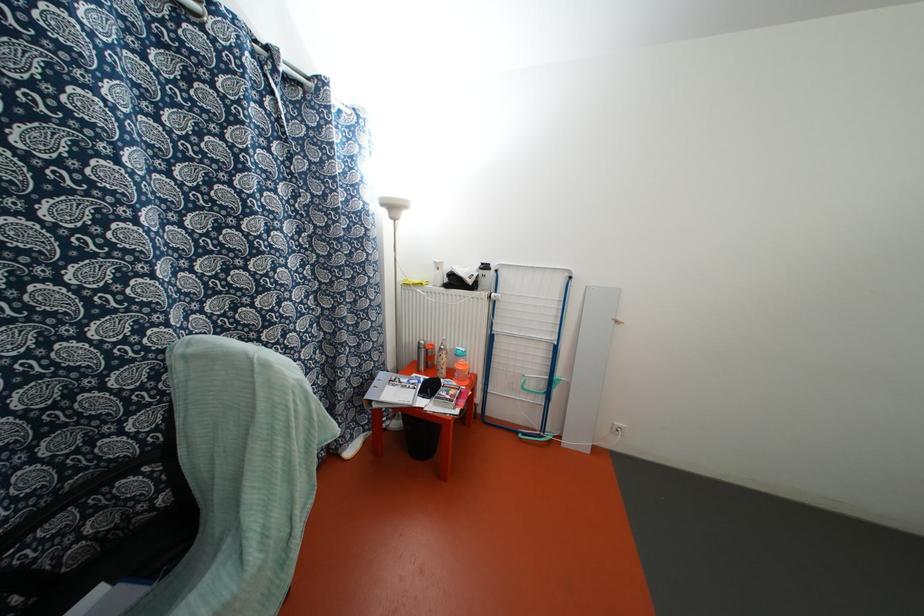
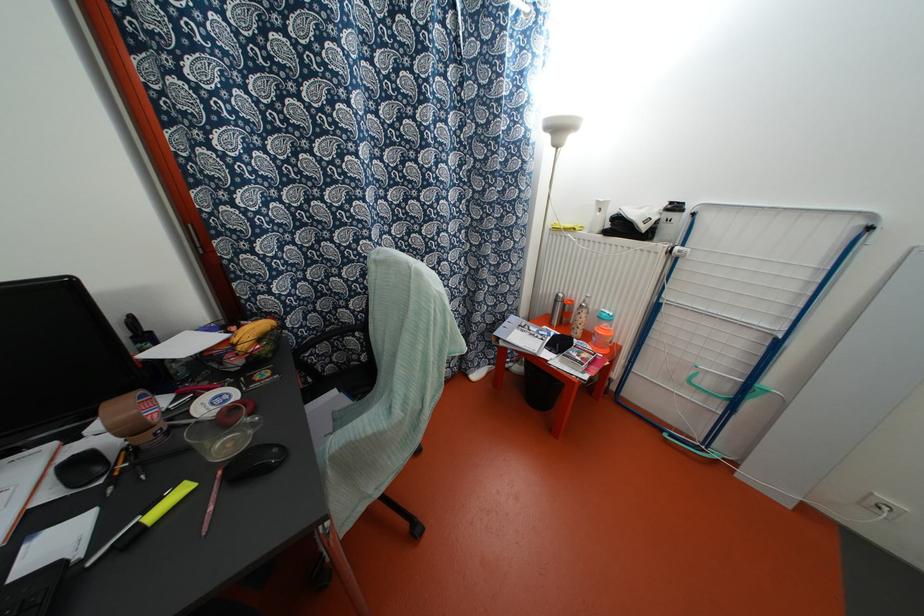
Find the pixel in the second image that matches pixel 408 414 in the first image.

(531, 362)